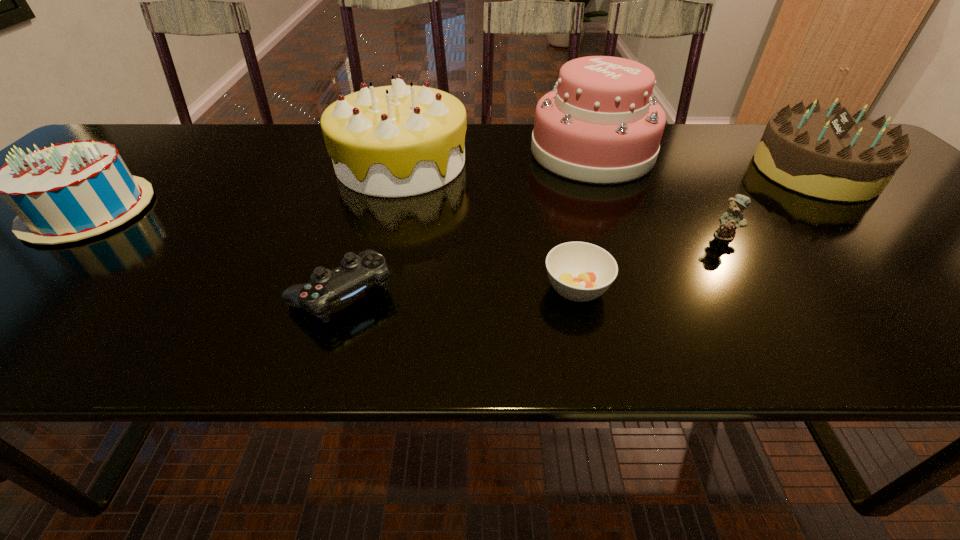
In order to click on cake in this screenshot , I will do `click(600, 124)`.

Where is `the tallest birthday cake`? This screenshot has height=540, width=960. the tallest birthday cake is located at coordinates (402, 140).

The width and height of the screenshot is (960, 540). Find the location of `the rightmost birthday cake`. the rightmost birthday cake is located at coordinates (831, 154).

This screenshot has height=540, width=960. Identify the location of the second object from right to left. (733, 218).

Where is `the third shortest object`? the third shortest object is located at coordinates (733, 218).

The image size is (960, 540). Identify the location of the sixth tallest object. (357, 273).

At what (x,y) coordinates should I click in order to perform the action: click on the shortest object. Please return your answer as a coordinate pair (x, y). The height and width of the screenshot is (540, 960). Looking at the image, I should click on (578, 271).

Where is `free space located on the front of the cake`? This screenshot has width=960, height=540. free space located on the front of the cake is located at coordinates (639, 279).

The image size is (960, 540). I want to click on vacant area located 0.360m on the left of the second birthday cake from right to left, so tap(194, 163).

The width and height of the screenshot is (960, 540). I want to click on free space located 0.190m on the front-facing side of the rightmost object, so click(x=682, y=171).